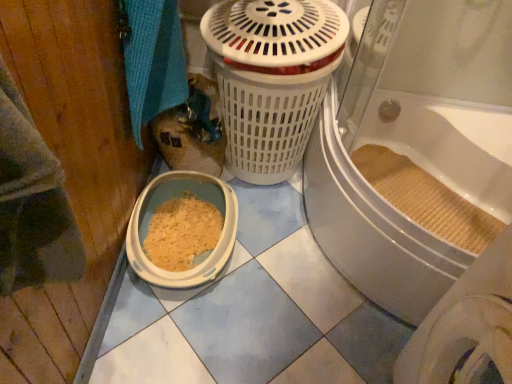
Question: From a real-world perspective, is white plastic litter box at lower left physically below blue woven towel at upper left?

Choices:
 (A) yes
 (B) no

Answer: (A)

Question: From the image's perspective, is white plastic litter box at lower left under blue woven towel at upper left?

Choices:
 (A) no
 (B) yes

Answer: (B)

Question: Is white plastic litter box at lower left far from blue woven towel at upper left?

Choices:
 (A) yes
 (B) no

Answer: (B)

Question: Is white plastic litter box at lower left shorter than blue woven towel at upper left?

Choices:
 (A) yes
 (B) no

Answer: (A)

Question: Is white plastic litter box at lower left to the right of blue woven towel at upper left from the viewer's perspective?

Choices:
 (A) no
 (B) yes

Answer: (B)

Question: Can you confirm if white plastic litter box at lower left is wider than blue woven towel at upper left?

Choices:
 (A) yes
 (B) no

Answer: (A)

Question: Is the depth of blue woven towel at upper left less than that of white plastic litter box at lower left?

Choices:
 (A) yes
 (B) no

Answer: (A)

Question: Could you tell me if blue woven towel at upper left is facing white plastic litter box at lower left?

Choices:
 (A) no
 (B) yes

Answer: (A)

Question: Is blue woven towel at upper left in contact with white plastic litter box at lower left?

Choices:
 (A) yes
 (B) no

Answer: (B)

Question: Is blue woven towel at upper left completely or partially outside of white plastic litter box at lower left?

Choices:
 (A) yes
 (B) no

Answer: (A)

Question: Considering the relative sizes of blue woven towel at upper left and white plastic litter box at lower left in the image provided, is blue woven towel at upper left wider than white plastic litter box at lower left?

Choices:
 (A) yes
 (B) no

Answer: (B)

Question: From the image's perspective, is blue woven towel at upper left under white plastic litter box at lower left?

Choices:
 (A) no
 (B) yes

Answer: (A)

Question: Can you confirm if white plastic litter box at lower left is taller than beige woven mat at bathtub?

Choices:
 (A) yes
 (B) no

Answer: (A)